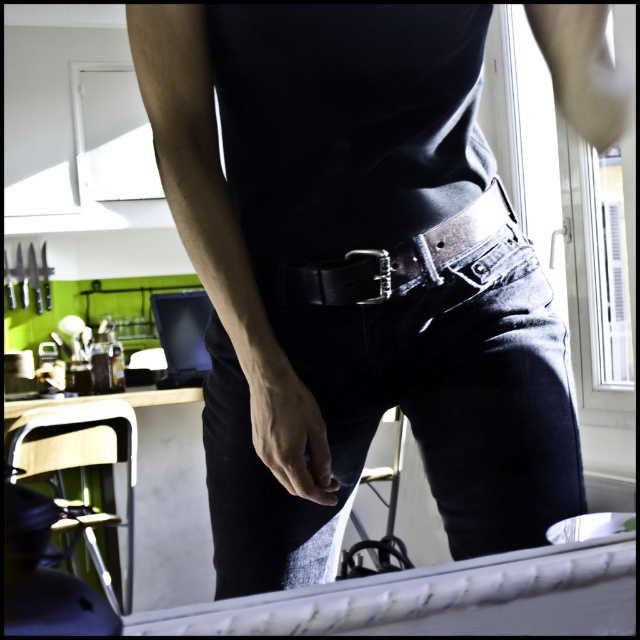
You are a fashion designer observing the person in the image. You need to determine the order of the leather belt at center and metallic silver belt buckle at center from the viewer. Which one is closer to you?

The leather belt at center is closer to you because it is in front of the metallic silver belt buckle at center.